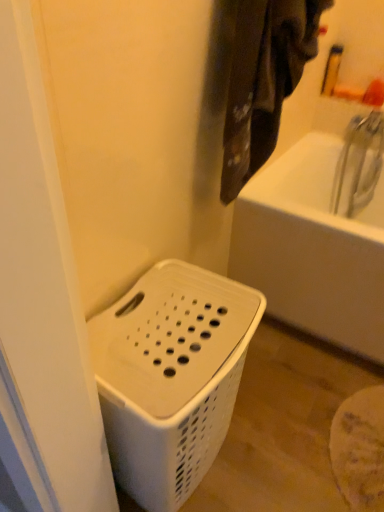
Question: Does white plastic laundry basket at upper right have a greater height compared to white plastic basket at lower left?

Choices:
 (A) yes
 (B) no

Answer: (B)

Question: Considering the relative positions of white plastic laundry basket at upper right and white plastic basket at lower left in the image provided, is white plastic laundry basket at upper right to the left of white plastic basket at lower left from the viewer's perspective?

Choices:
 (A) no
 (B) yes

Answer: (A)

Question: From the image's perspective, is white plastic laundry basket at upper right below white plastic basket at lower left?

Choices:
 (A) yes
 (B) no

Answer: (B)

Question: Is white plastic laundry basket at upper right at the right side of white plastic basket at lower left?

Choices:
 (A) no
 (B) yes

Answer: (B)

Question: Does white plastic laundry basket at upper right turn towards white plastic basket at lower left?

Choices:
 (A) yes
 (B) no

Answer: (B)

Question: Considering the relative sizes of white plastic laundry basket at upper right and white plastic basket at lower left in the image provided, is white plastic laundry basket at upper right smaller than white plastic basket at lower left?

Choices:
 (A) yes
 (B) no

Answer: (A)

Question: Is white plastic basket at lower left looking in the opposite direction of white plastic laundry basket at upper right?

Choices:
 (A) yes
 (B) no

Answer: (B)

Question: Is white plastic basket at lower left aimed at white plastic laundry basket at upper right?

Choices:
 (A) yes
 (B) no

Answer: (B)

Question: Does white plastic basket at lower left have a smaller size compared to white plastic laundry basket at upper right?

Choices:
 (A) no
 (B) yes

Answer: (A)

Question: Is white plastic basket at lower left not inside white plastic laundry basket at upper right?

Choices:
 (A) yes
 (B) no

Answer: (A)

Question: From a real-world perspective, is white plastic basket at lower left physically below white plastic laundry basket at upper right?

Choices:
 (A) no
 (B) yes

Answer: (B)

Question: Considering the relative sizes of white plastic basket at lower left and white plastic laundry basket at upper right in the image provided, is white plastic basket at lower left bigger than white plastic laundry basket at upper right?

Choices:
 (A) no
 (B) yes

Answer: (B)

Question: Considering their positions, is white plastic laundry basket at upper right located in front of or behind white plastic basket at lower left?

Choices:
 (A) behind
 (B) front

Answer: (A)